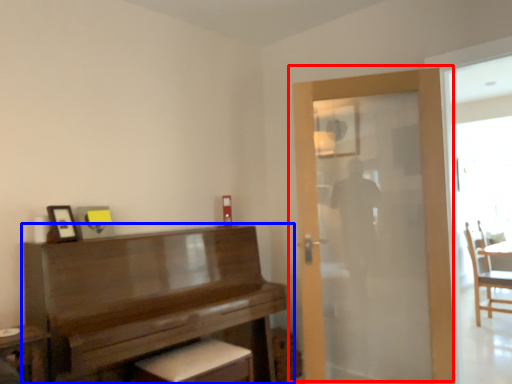
Question: Which object appears farthest to the camera in this image, door (highlighted by a red box) or piano (highlighted by a blue box)?

Choices:
 (A) door
 (B) piano

Answer: (A)